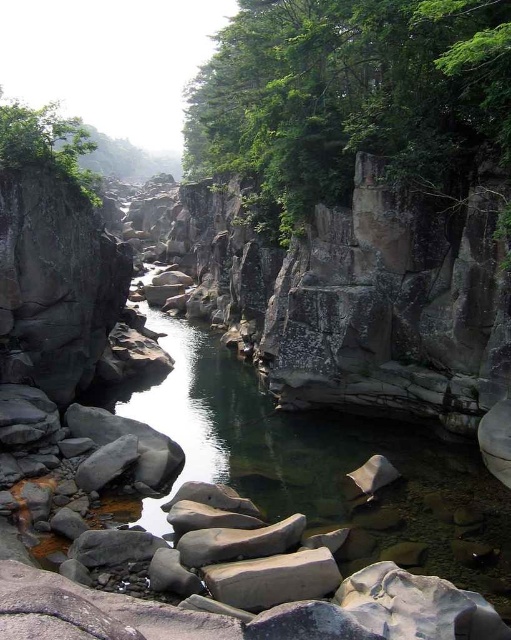
Question: Among these points, which one is farthest from the camera?

Choices:
 (A) (56, 124)
 (B) (359, 97)

Answer: (B)

Question: Can you confirm if green leafy tree at upper center is thinner than green leafy tree at upper left?

Choices:
 (A) yes
 (B) no

Answer: (A)

Question: Does green leafy tree at upper center have a smaller size compared to green leafy tree at upper left?

Choices:
 (A) yes
 (B) no

Answer: (A)

Question: Which point appears farthest from the camera in this image?

Choices:
 (A) coord(360,33)
 (B) coord(28,141)

Answer: (A)

Question: Is green leafy tree at upper center thinner than green leafy tree at upper left?

Choices:
 (A) no
 (B) yes

Answer: (B)

Question: Which object appears farthest from the camera in this image?

Choices:
 (A) green leafy tree at upper center
 (B) green leafy tree at upper left

Answer: (B)